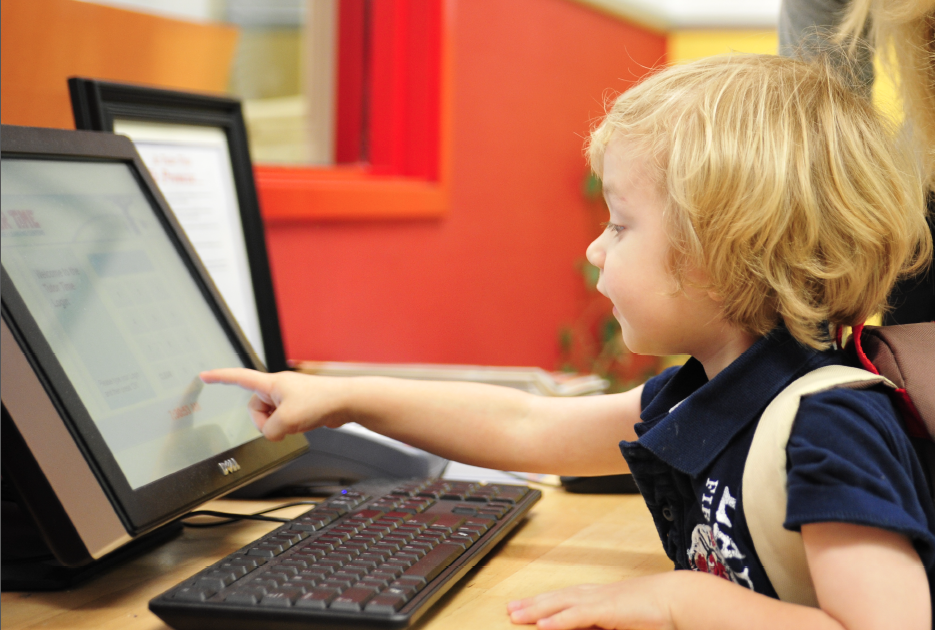
You are a GUI agent. You are given a task and a screenshot of the screen. Output one action in this format:
    pyautogui.click(x=<x>, y=<y>)
    Task: Click on the 1 bookbag strap
    
    Given the screenshot: What is the action you would take?
    pyautogui.click(x=770, y=467)